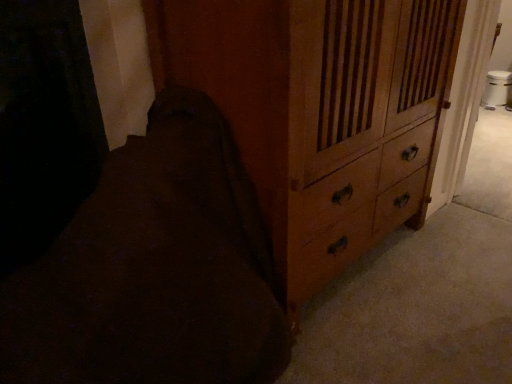
Image resolution: width=512 pixels, height=384 pixels. Identify the location of dark brown fabric at lower left. (154, 269).

The image size is (512, 384). What do you see at coordinates (154, 269) in the screenshot? I see `dark brown fabric at lower left` at bounding box center [154, 269].

What is the approximate width of dark brown fabric at lower left?

It is 30.49 inches.

This screenshot has width=512, height=384. What are the coordinates of `wooden chest of drawers at center-right` in the screenshot? It's located at (320, 113).

This screenshot has height=384, width=512. What do you see at coordinates (320, 113) in the screenshot? I see `wooden chest of drawers at center-right` at bounding box center [320, 113].

Find the location of a particular element. The image size is (512, 384). dark brown fabric at lower left is located at coordinates (154, 269).

Which object is positioned more to the right, wooden chest of drawers at center-right or dark brown fabric at lower left?

wooden chest of drawers at center-right is more to the right.

Which object is further away from the camera taking this photo, wooden chest of drawers at center-right or dark brown fabric at lower left?

wooden chest of drawers at center-right.

Is point (364, 50) closer to viewer compared to point (260, 254)?

That is True.

From the image's perspective, between wooden chest of drawers at center-right and dark brown fabric at lower left, which one is located above?

From the image's view, wooden chest of drawers at center-right is above.

From a real-world perspective, is wooden chest of drawers at center-right positioned under dark brown fabric at lower left based on gravity?

Incorrect, from a real-world perspective, wooden chest of drawers at center-right is higher than dark brown fabric at lower left.

Can you confirm if wooden chest of drawers at center-right is thinner than dark brown fabric at lower left?

Indeed, wooden chest of drawers at center-right has a lesser width compared to dark brown fabric at lower left.

Considering the relative sizes of wooden chest of drawers at center-right and dark brown fabric at lower left in the image provided, is wooden chest of drawers at center-right shorter than dark brown fabric at lower left?

Incorrect, the height of wooden chest of drawers at center-right does not fall short of that of dark brown fabric at lower left.

Based on the photo, considering the sizes of objects wooden chest of drawers at center-right and dark brown fabric at lower left in the image provided, who is smaller, wooden chest of drawers at center-right or dark brown fabric at lower left?

With smaller size is dark brown fabric at lower left.

Is wooden chest of drawers at center-right situated inside dark brown fabric at lower left or outside?

wooden chest of drawers at center-right is spatially situated outside dark brown fabric at lower left.

Is wooden chest of drawers at center-right next to dark brown fabric at lower left and touching it?

No, wooden chest of drawers at center-right is not touching dark brown fabric at lower left.

Is wooden chest of drawers at center-right turned away from dark brown fabric at lower left?

That's not correct — wooden chest of drawers at center-right is not looking away from dark brown fabric at lower left.

What's the angular difference between wooden chest of drawers at center-right and dark brown fabric at lower left's facing directions?

The angle between the facing direction of wooden chest of drawers at center-right and the facing direction of dark brown fabric at lower left is 90 degrees.

Measure the distance from wooden chest of drawers at center-right to dark brown fabric at lower left.

wooden chest of drawers at center-right and dark brown fabric at lower left are 13.81 inches apart.

Locate an element on the screen. The width and height of the screenshot is (512, 384). the chest of drawers lying behind the dark brown fabric at lower left is located at coordinates (320, 113).

Is dark brown fabric at lower left at the left side of wooden chest of drawers at center-right?

Indeed, dark brown fabric at lower left is positioned on the left side of wooden chest of drawers at center-right.

Considering the relative positions of dark brown fabric at lower left and wooden chest of drawers at center-right in the image provided, is dark brown fabric at lower left in front of wooden chest of drawers at center-right?

That is True.

Which is closer, (87,274) or (457,27)?

Point (87,274)

Based on the photo, from the image's perspective, between dark brown fabric at lower left and wooden chest of drawers at center-right, who is located below?

dark brown fabric at lower left.

From a real-world perspective, is dark brown fabric at lower left located beneath wooden chest of drawers at center-right?

Indeed, from a real-world perspective, dark brown fabric at lower left is positioned beneath wooden chest of drawers at center-right.

Which object is wider, dark brown fabric at lower left or wooden chest of drawers at center-right?

dark brown fabric at lower left.

Who is taller, dark brown fabric at lower left or wooden chest of drawers at center-right?

wooden chest of drawers at center-right is taller.

Can you confirm if dark brown fabric at lower left is smaller than wooden chest of drawers at center-right?

Correct, dark brown fabric at lower left occupies less space than wooden chest of drawers at center-right.

Would you say dark brown fabric at lower left is outside wooden chest of drawers at center-right?

Yes, dark brown fabric at lower left is not within wooden chest of drawers at center-right.

Is there a large distance between dark brown fabric at lower left and wooden chest of drawers at center-right?

dark brown fabric at lower left is near wooden chest of drawers at center-right, not far away.

Is dark brown fabric at lower left looking in the opposite direction of wooden chest of drawers at center-right?

Yes, dark brown fabric at lower left's orientation is away from wooden chest of drawers at center-right.

Consider the image. What's the angular difference between dark brown fabric at lower left and wooden chest of drawers at center-right's facing directions?

90 degrees.

Image resolution: width=512 pixels, height=384 pixels. In the image, there is a dark brown fabric at lower left. Identify the location of the chest of drawers above it (from the image's perspective). (320, 113).

Locate an element on the screen. The height and width of the screenshot is (384, 512). the chest of drawers located above the dark brown fabric at lower left (from the image's perspective) is located at coordinates (320, 113).

Find the location of `chest of drawers above the dark brown fabric at lower left (from a real-world perspective)`. chest of drawers above the dark brown fabric at lower left (from a real-world perspective) is located at coordinates (320, 113).